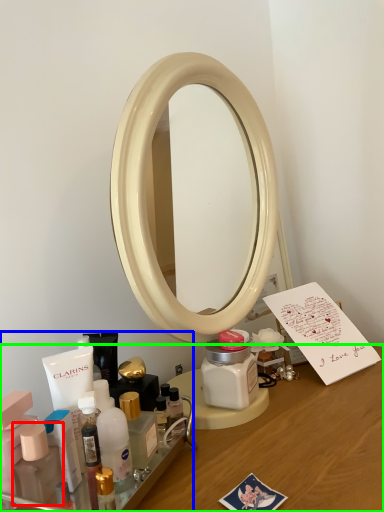
Question: Based on their relative distances, which object is nearer to toiletry (highlighted by a red box)? Choose from toiletry (highlighted by a blue box) and desk (highlighted by a green box).

Choices:
 (A) toiletry
 (B) desk

Answer: (A)